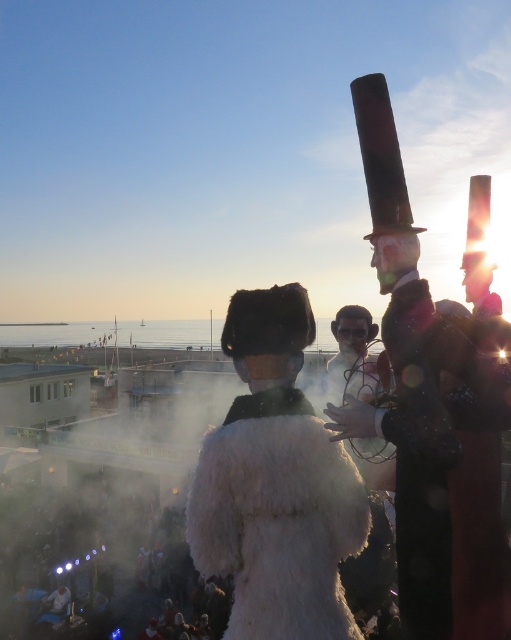
Measure the distance between shiny black suit at center and camera.

shiny black suit at center is 4.32 meters away from camera.

Does point (391, 268) come in front of point (346, 554)?

Yes.

The image size is (511, 640). In order to click on shiny black suit at center in this screenshot , I will do `click(440, 452)`.